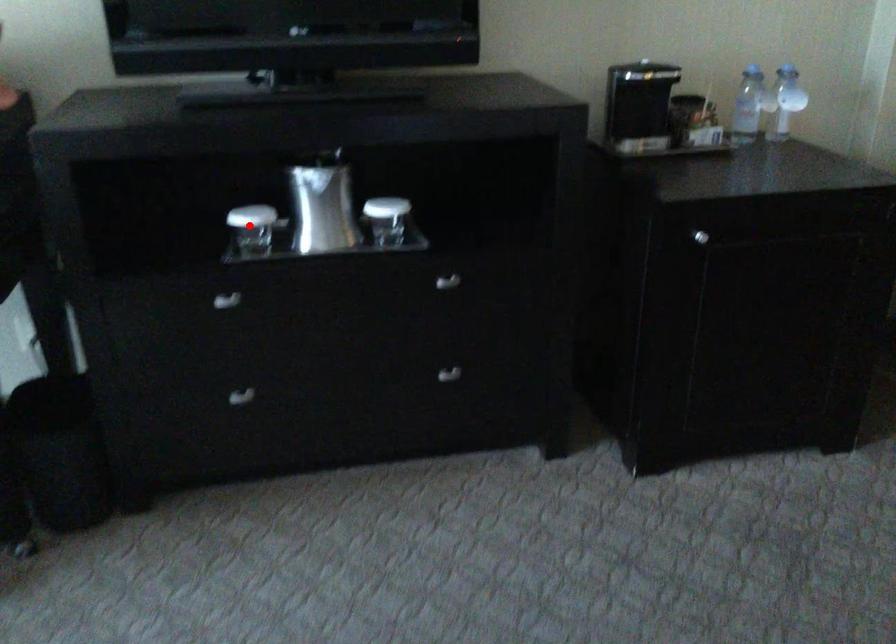
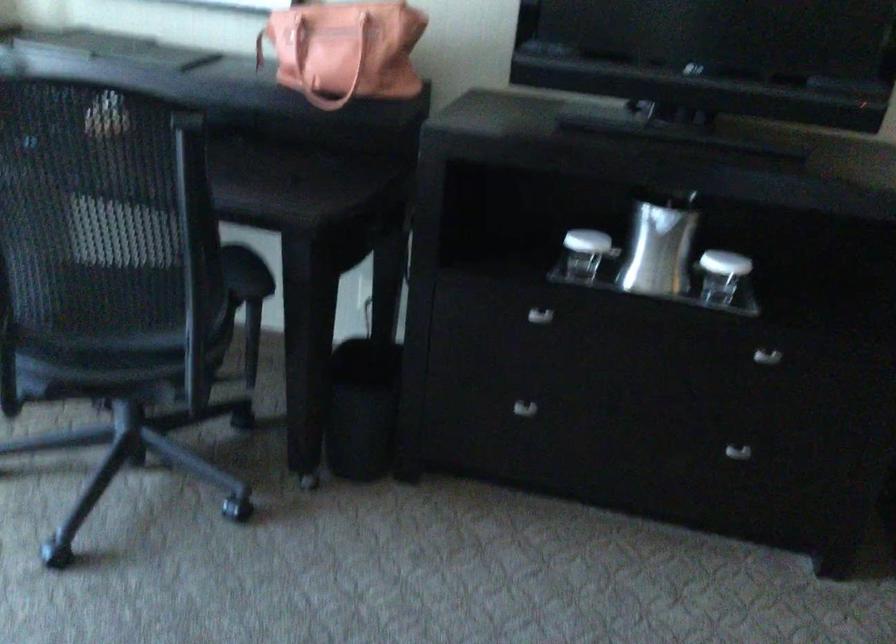
Question: I am providing you with two images of the same scene from different viewpoints. A red point is marked on the first image. Is the red point's position out of view in image 2?

Choices:
 (A) Yes
 (B) No

Answer: (B)